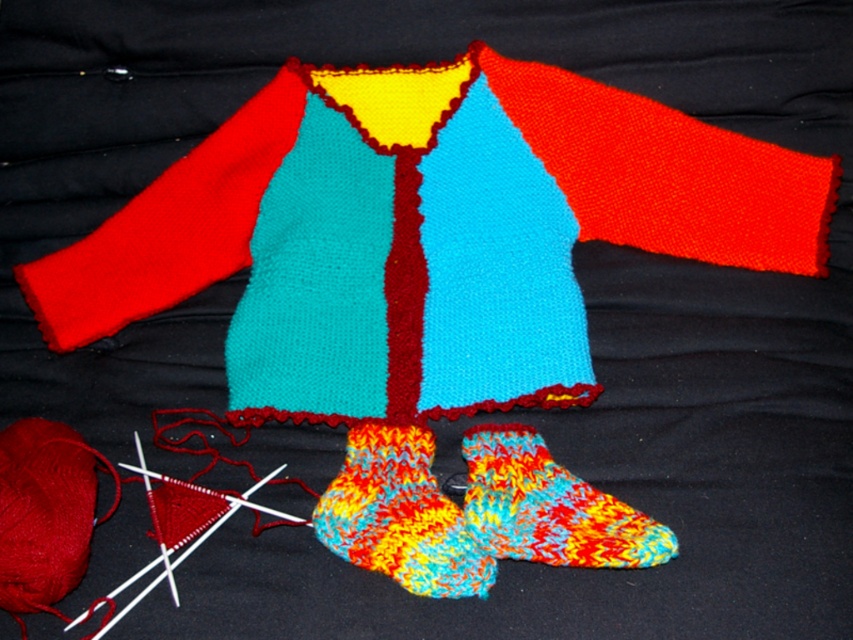
Is knitted wool sweater at center further to camera compared to multicolored knitted sock at lower center?

Yes.

Does knitted wool sweater at center appear under multicolored knitted sock at lower center?

Incorrect, knitted wool sweater at center is not positioned below multicolored knitted sock at lower center.

Image resolution: width=853 pixels, height=640 pixels. Identify the location of knitted wool sweater at center. (422, 232).

Who is more forward, [753,173] or [357,556]?

Positioned in front is point [357,556].

From the picture: Is knitted wool sweater at center closer to the viewer compared to multicolored knitted sock at center?

No, knitted wool sweater at center is further to the viewer.

Is point (120, 294) positioned behind point (390, 513)?

Yes, point (120, 294) is farther from viewer.

The height and width of the screenshot is (640, 853). Identify the location of knitted wool sweater at center. (422, 232).

Can you confirm if multicolored knitted sock at center is wider than multicolored knitted sock at lower center?

In fact, multicolored knitted sock at center might be narrower than multicolored knitted sock at lower center.

Measure the distance from multicolored knitted sock at center to multicolored knitted sock at lower center.

multicolored knitted sock at center is 3.36 inches from multicolored knitted sock at lower center.

You are a GUI agent. You are given a task and a screenshot of the screen. Output one action in this format:
    pyautogui.click(x=<x>, y=<y>)
    Task: Click on the multicolored knitted sock at center
    This screenshot has width=853, height=640.
    Given the screenshot: What is the action you would take?
    pyautogui.click(x=399, y=515)